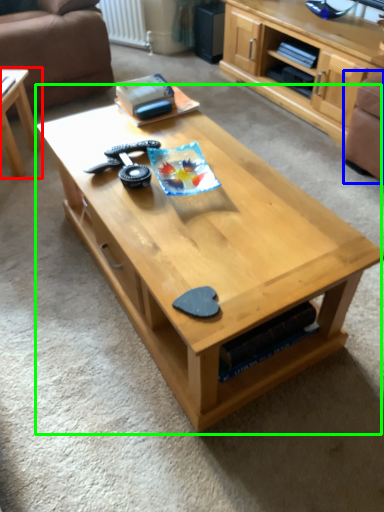
Question: Which object is the closest to the coffee table (highlighted by a red box)? Choose among these: armchair (highlighted by a blue box) or coffee table (highlighted by a green box).

Choices:
 (A) armchair
 (B) coffee table

Answer: (B)